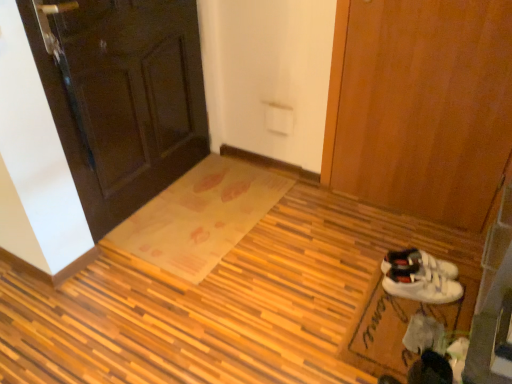
At what (x,y) coordinates should I click in order to perform the action: click on free space above translucent plastic doormat at center, which ranks as the 1th doormat in back-to-front order (from a real-world perspective). Please return your answer as a coordinate pair (x, y). Image resolution: width=512 pixels, height=384 pixels. Looking at the image, I should click on (205, 208).